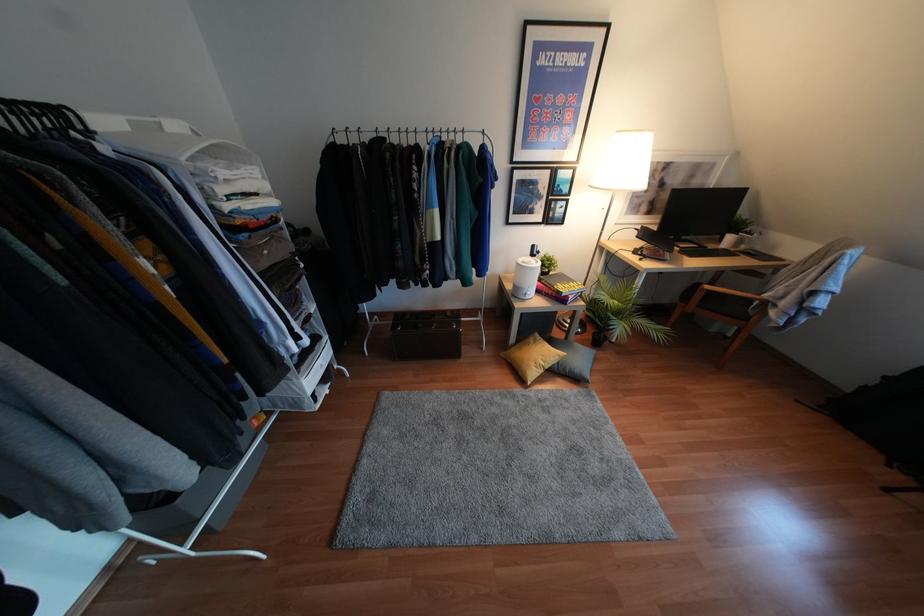
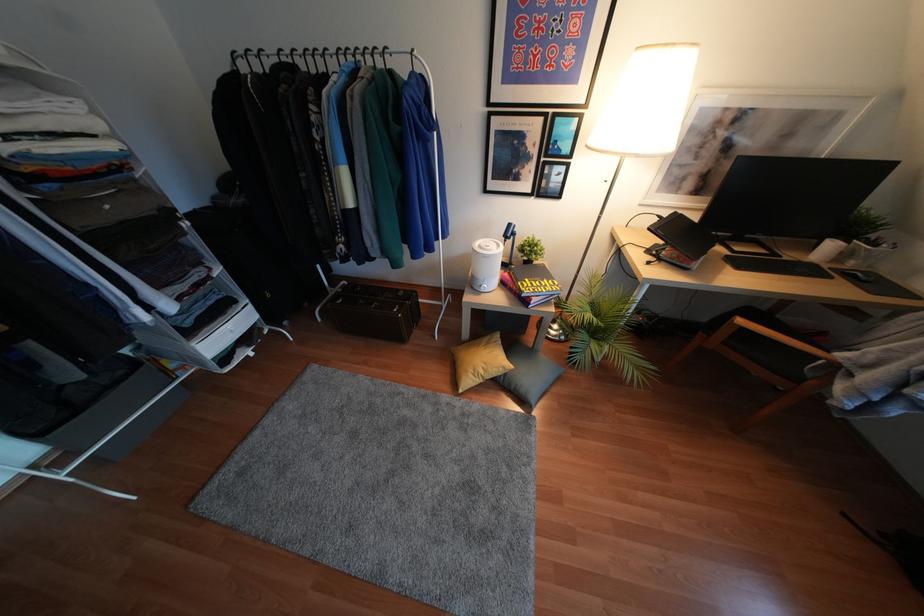
The point at (x=526, y=297) is marked in the first image. Where is the corresponding point in the second image?

(481, 290)